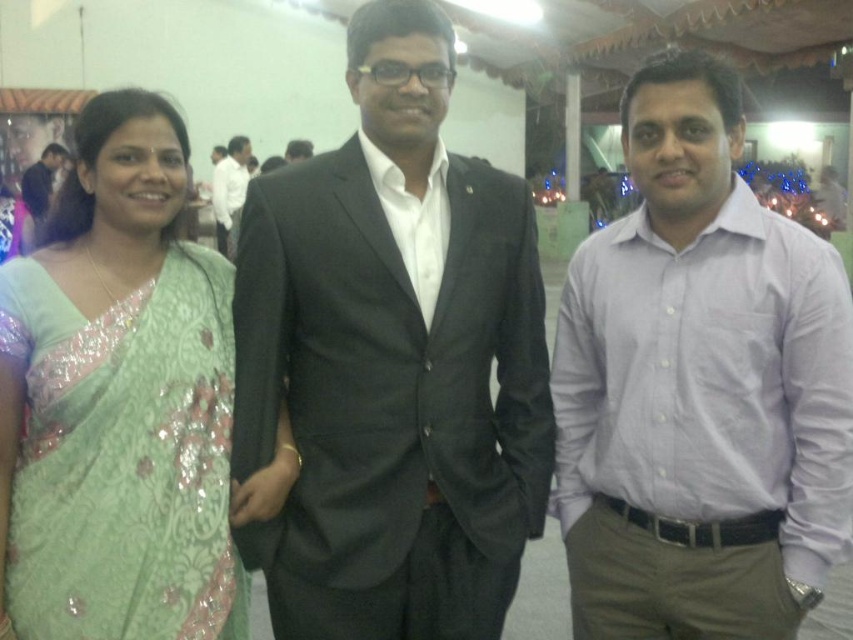
You are a photographer at the event and need to adjust the lighting to ensure both the black matte suit at center and dark gray suit at center are visible. Which suit requires more light to be properly illuminated?

The black matte suit at center requires more light to be properly illuminated because black absorbs more light than dark gray.

You are a photographer adjusting your camera settings and notice the black matte suit at center and the light purple shirt at center. Which one is closer to you?

The black matte suit at center is closer to you than the light purple shirt at center.

You are a photographer adjusting the camera settings for a group photo. The subjects are wearing a black matte suit at center and a dark gray suit at center. Which suit should you focus on first if you want to ensure the widest part of the group is in sharp focus?

The black matte suit at center has a greater width than the dark gray suit at center, so focusing on the black matte suit at center first will ensure the widest part of the group is captured sharply.